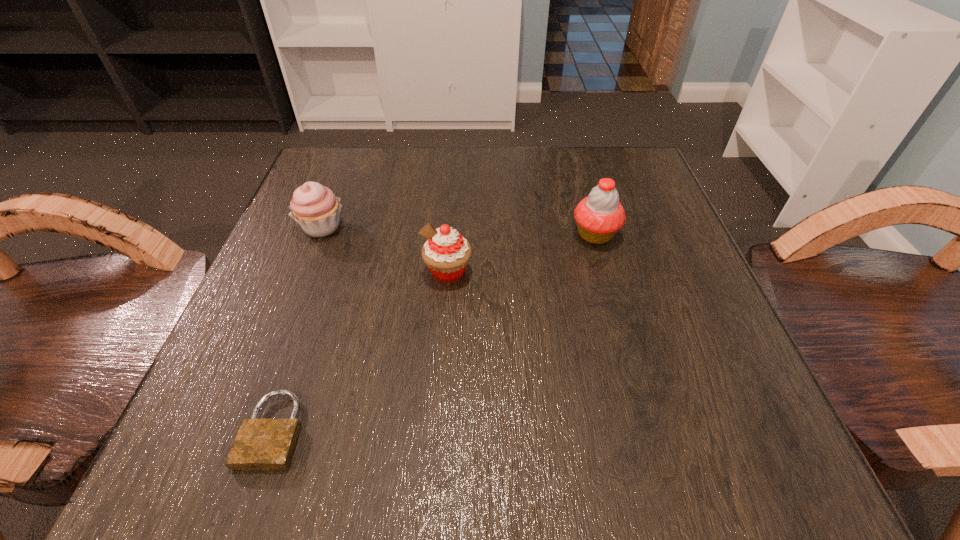
Image resolution: width=960 pixels, height=540 pixels. Find the location of `empty location between the rightmost cupcake and the nearest object`. empty location between the rightmost cupcake and the nearest object is located at coordinates (434, 332).

Where is `free space between the leftmost cupcake and the rightmost object`? This screenshot has height=540, width=960. free space between the leftmost cupcake and the rightmost object is located at coordinates [459, 231].

The height and width of the screenshot is (540, 960). What are the coordinates of `empty space that is in between the leftmost cupcake and the second object from right to left` in the screenshot? It's located at [x=385, y=249].

Locate an element on the screen. Image resolution: width=960 pixels, height=540 pixels. vacant space that is in between the leftmost cupcake and the rightmost object is located at coordinates (459, 231).

This screenshot has height=540, width=960. What are the coordinates of `empty space between the rightmost cupcake and the shortest object` in the screenshot? It's located at (434, 332).

Locate an element on the screen. This screenshot has width=960, height=540. vacant area between the rightmost cupcake and the leftmost cupcake is located at coordinates (459, 231).

This screenshot has height=540, width=960. In order to click on vacant region between the shortest object and the second cupcake from right to left in this screenshot , I will do `click(361, 350)`.

Identify the location of vacant space that's between the rightmost object and the third object from left to right. The image size is (960, 540). (521, 253).

Where is `free space between the leftmost cupcake and the shortest object`? The width and height of the screenshot is (960, 540). free space between the leftmost cupcake and the shortest object is located at coordinates (298, 328).

Identify the location of free spot between the second object from right to left and the padlock. The width and height of the screenshot is (960, 540). (361, 350).